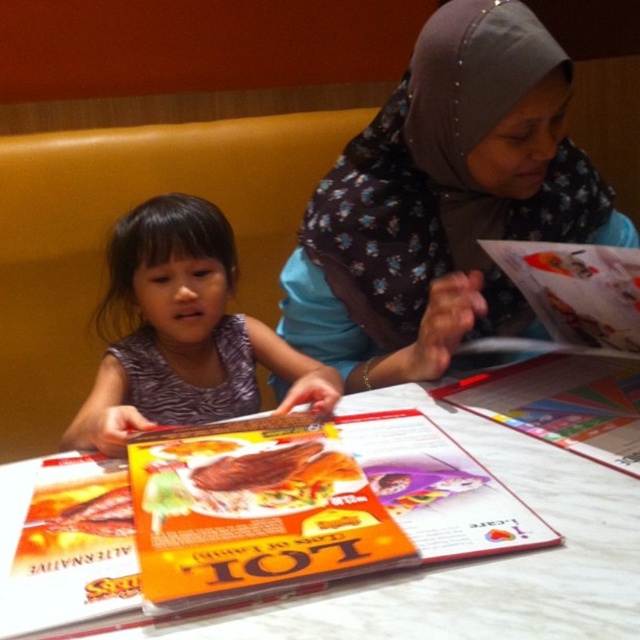
You are a server who needs to place a 12 inch dessert plate on the table. The plate is as wide as the orange glossy menu at center. Can the white glossy table at center accommodate the dessert plate?

The white glossy table at center is wider than the orange glossy menu at center, so the dessert plate, which is as wide as the menu, will fit on the table.

You are a waiter in a restaurant and you see the purple fabric dress at center and the orange glossy menu at center. Which object is closer to you?

The purple fabric dress at center is closer to you because it is in front of the orange glossy menu at center.

You are a customer at this restaurant and want to point out two specific points on the menu to the server. The first point is at coordinates point (531, 310) and the second is at point (588, 492). Which of these two points is closer to you as you look at the menu?

Point (531, 310) is closer to you than point (588, 492) because it is further to the viewer.